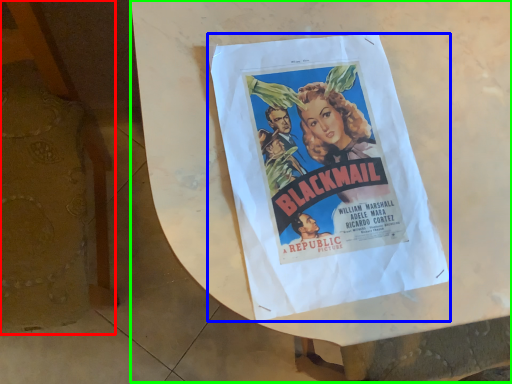
Question: Which object is positioned closest to furniture (highlighted by a red box)? Select from poster (highlighted by a blue box) and round table (highlighted by a green box).

Choices:
 (A) poster
 (B) round table

Answer: (B)